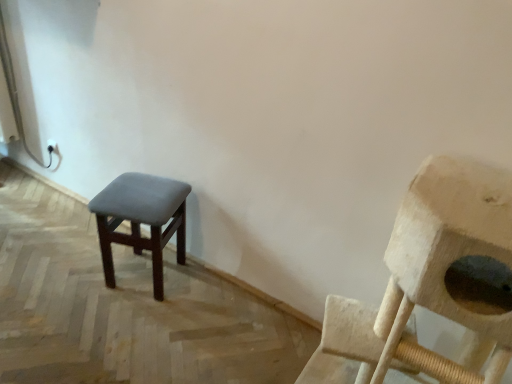
The height and width of the screenshot is (384, 512). Identify the location of vacant space situated above dark gray fabric stool at left (from a real-world perspective). (143, 190).